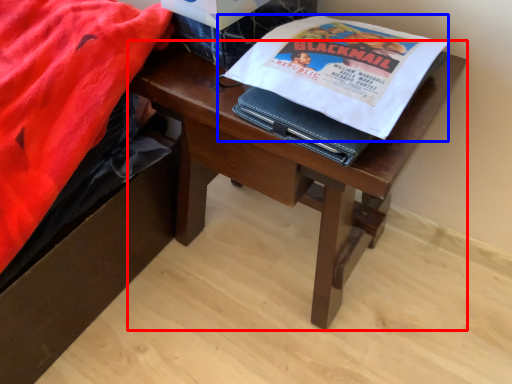
Question: Which of the following is the closest to the observer, desk (highlighted by a red box) or paperback book (highlighted by a blue box)?

Choices:
 (A) desk
 (B) paperback book

Answer: (B)